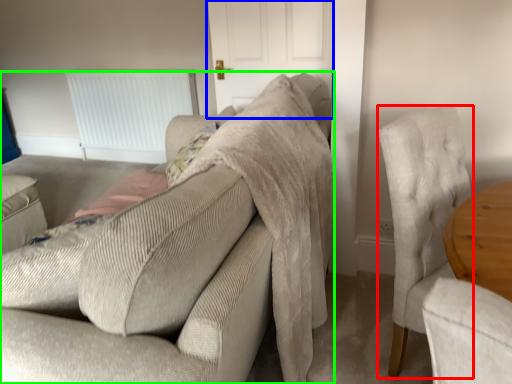
Question: Estimate the real-world distances between objects in this image. Which object is closer to chair (highlighted by a red box), door (highlighted by a blue box) or studio couch (highlighted by a green box)?

Choices:
 (A) door
 (B) studio couch

Answer: (B)